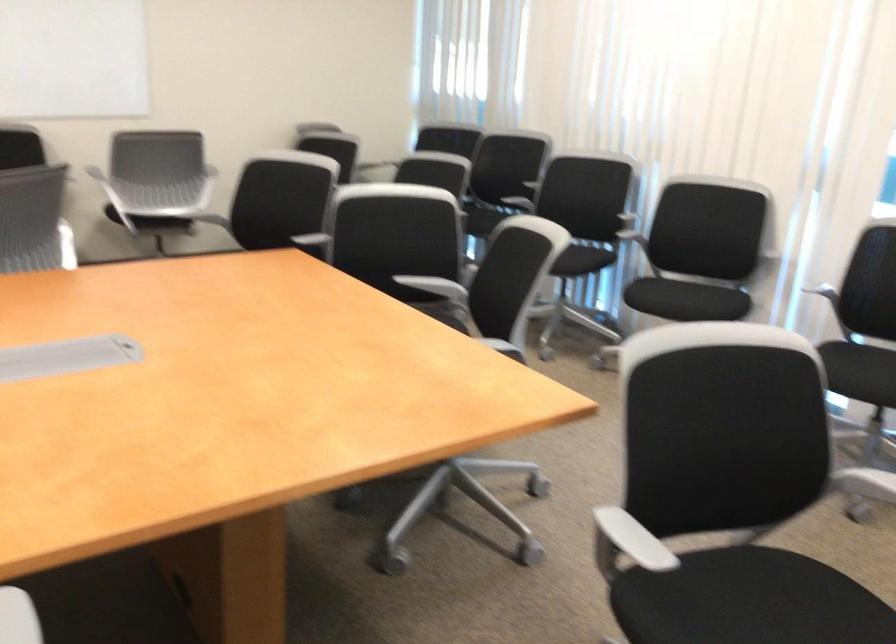
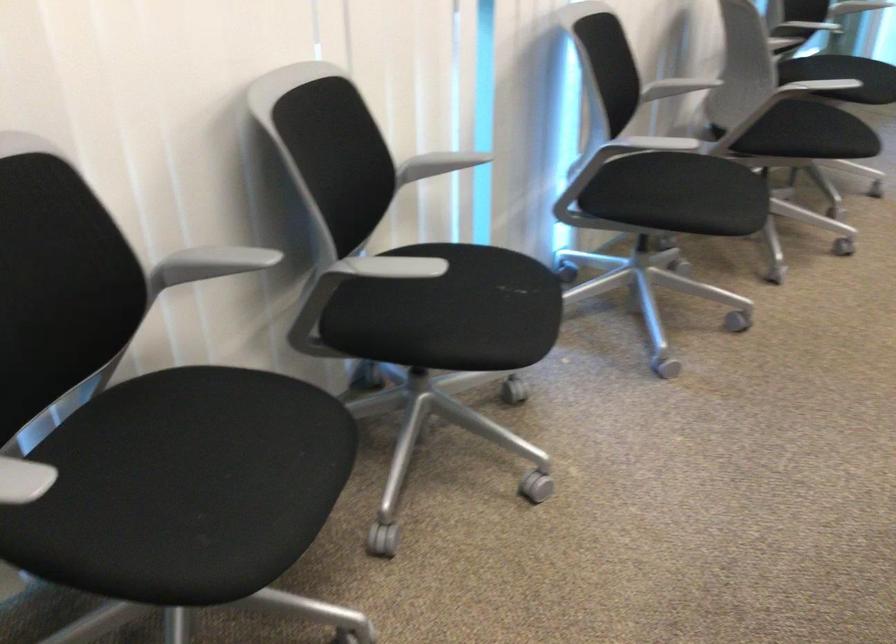
Find the pixel in the second image that matches [625,207] in the first image.

(211, 263)